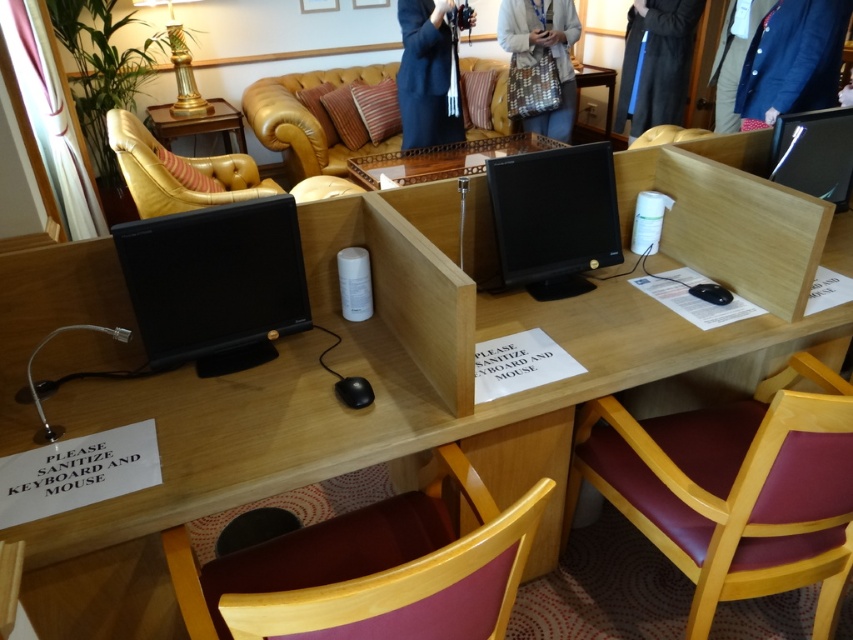
Question: Based on their relative distances, which object is nearer to the gold/gilded column at upper left?

Choices:
 (A) matte black monitor at left
 (B) wooden table at center
 (C) matte black monitor at center

Answer: (B)

Question: Which point appears farthest from the camera in this image?

Choices:
 (A) (759, 593)
 (B) (621, 118)
 (C) (299, 305)
 (D) (840, 113)

Answer: (B)

Question: Which point appears farthest from the camera in this image?

Choices:
 (A) (778, 170)
 (B) (302, 305)
 (C) (364, 176)

Answer: (C)

Question: From the image, what is the correct spatial relationship of leather-like burgundy armchair at lower right in relation to metallic silver monitor at upper right?

Choices:
 (A) above
 (B) below

Answer: (B)

Question: Can you confirm if purple fabric chair at lower center is positioned to the right of patterned fabric handbag at upper center?

Choices:
 (A) no
 (B) yes

Answer: (A)

Question: Is purple fabric chair at lower center bigger than gold/gilded column at upper left?

Choices:
 (A) no
 (B) yes

Answer: (B)